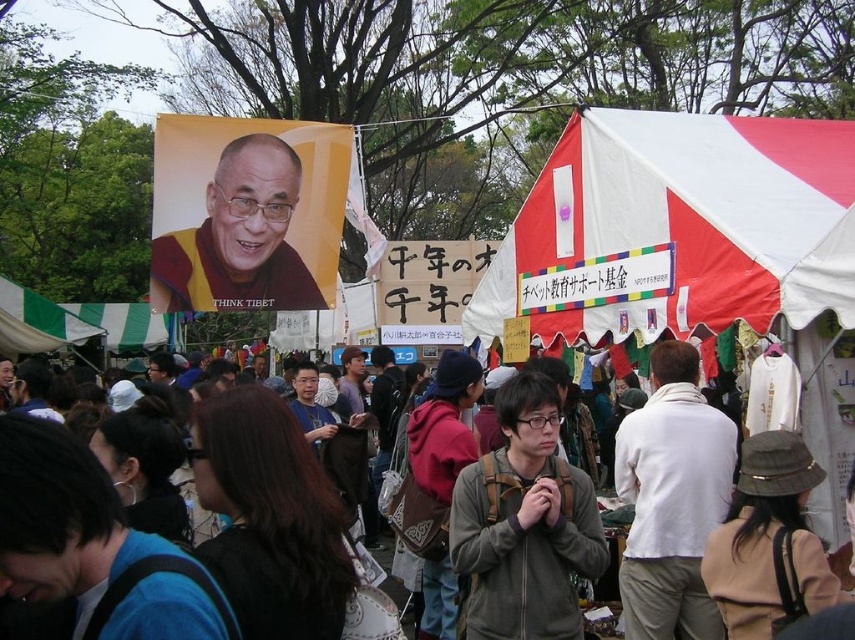
You are a participant at this event and want to move from the red and white tent at upper right to the brown hair at center. Can you walk directly between them without needing to detour around any obstacles?

The distance between the red and white tent at upper right and the brown hair at center is 10.67 meters, so yes, you can walk directly between them without needing to detour around any obstacles since there is enough space.

You are standing at the center of the park and see two points in the image. The first point is at coordinates point (694, 508) and the second is at point (237, 298). Which point is closer to you?

Point (694, 508) is closer to the viewer than point (237, 298).